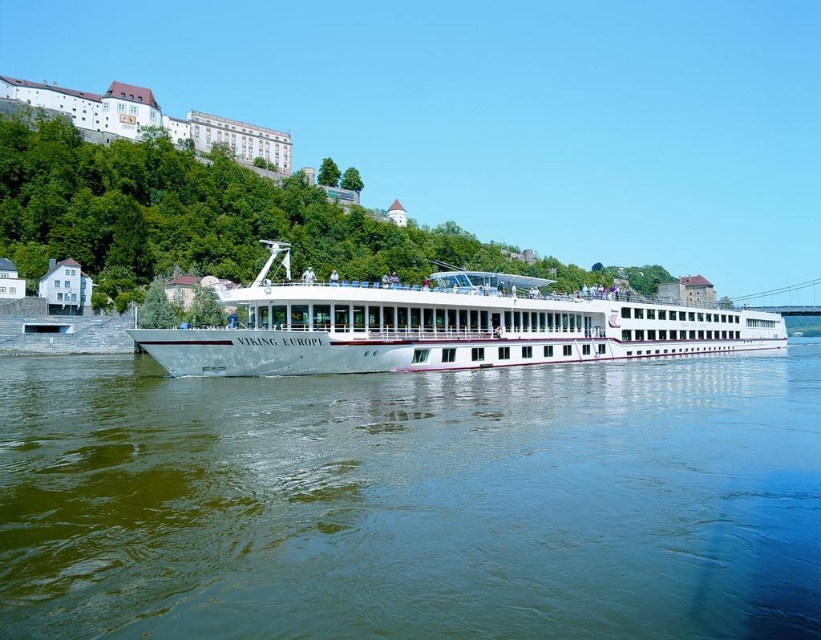
Is the position of greenish water at center more distant than that of white glossy cruise ship at center?

That is False.

What do you see at coordinates (411, 500) in the screenshot? The width and height of the screenshot is (821, 640). I see `greenish water at center` at bounding box center [411, 500].

Where is `greenish water at center`? The image size is (821, 640). greenish water at center is located at coordinates (411, 500).